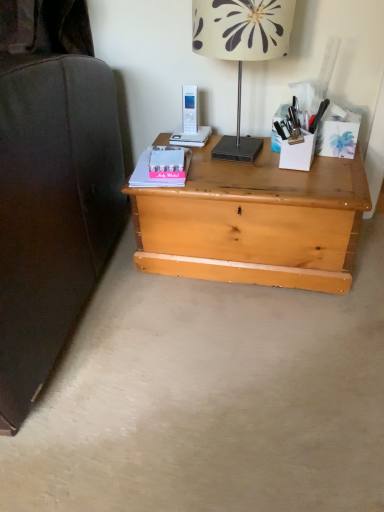
You are a GUI agent. You are given a task and a screenshot of the screen. Output one action in this format:
    pyautogui.click(x=<x>, y=<y>)
    Task: Click on the vacant space in front of white floral lampshade at upper center
    The image size is (384, 512).
    Given the screenshot: What is the action you would take?
    pyautogui.click(x=265, y=181)